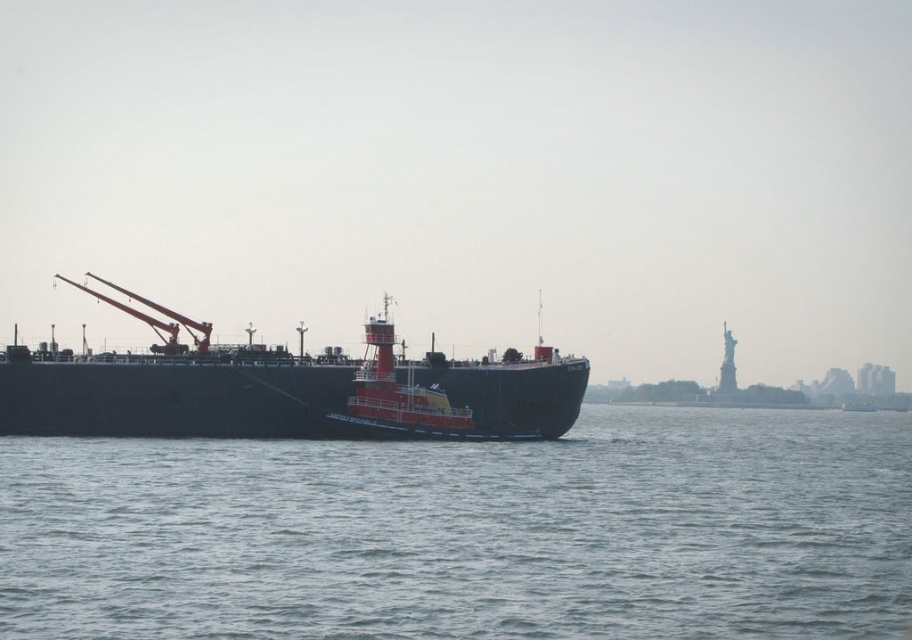
Between point (91, 506) and point (486, 428), which one is positioned in front?

Point (91, 506) is more forward.

Between point (413, 572) and point (22, 365), which one is positioned behind?

The point (22, 365) is more distant.

The image size is (912, 640). Identify the location of gray water at center. (469, 532).